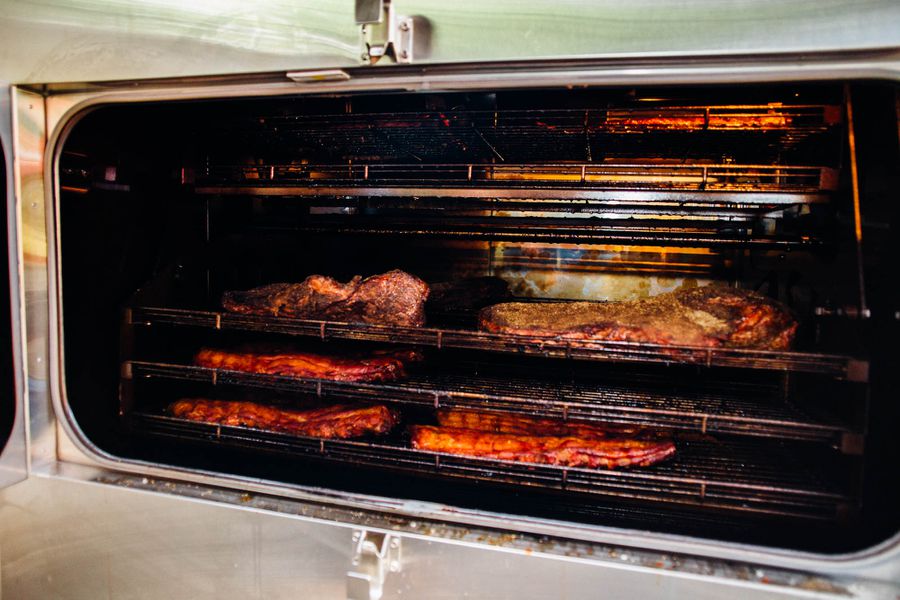
Identify the location of bottom hinge. This screenshot has height=600, width=900. (362, 565).